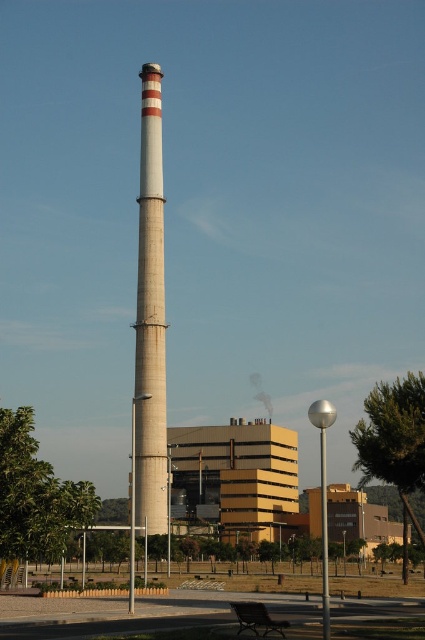
You are a visitor at a park and see the concrete chimney at center and the wooden park bench at lower center. Which object is closer to you?

The wooden park bench at lower center is closer to you because the concrete chimney at center is positioned over it, indicating it is further away.

You are standing at the lower center of the image and want to take a photo of the concrete chimney at center without any obstructions. Is the wooden park bench at lower center blocking your view of the chimney?

The wooden park bench at lower center is behind the concrete chimney at center, so it will not block your view of the chimney when taking a photo from your current position at the lower center.

Looking at this image, you are planning to place a new wooden park bench at lower center next to the concrete chimney at center. Considering their widths, which object will require more horizontal space in the area?

The concrete chimney at center requires more horizontal space because its width is larger than the wooden park bench at lower center.